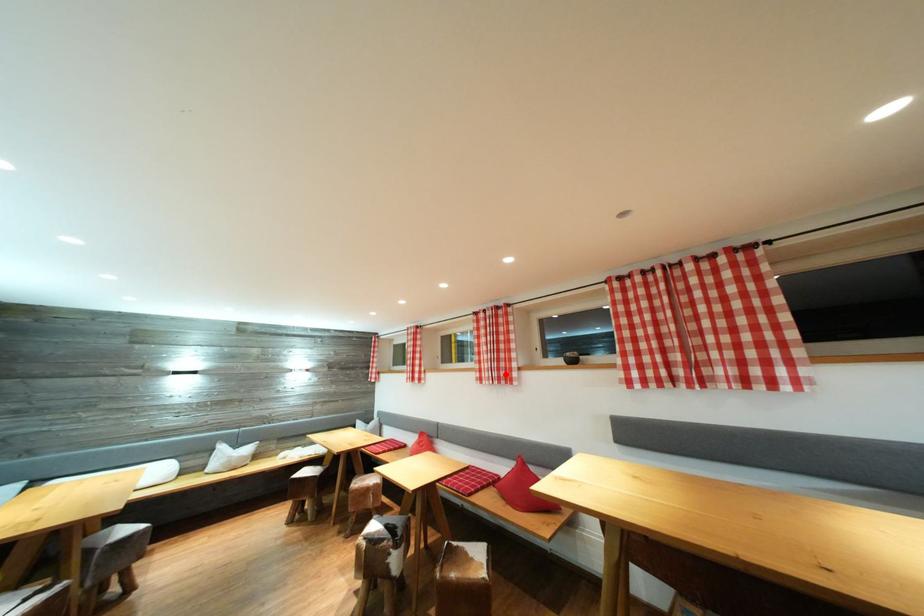
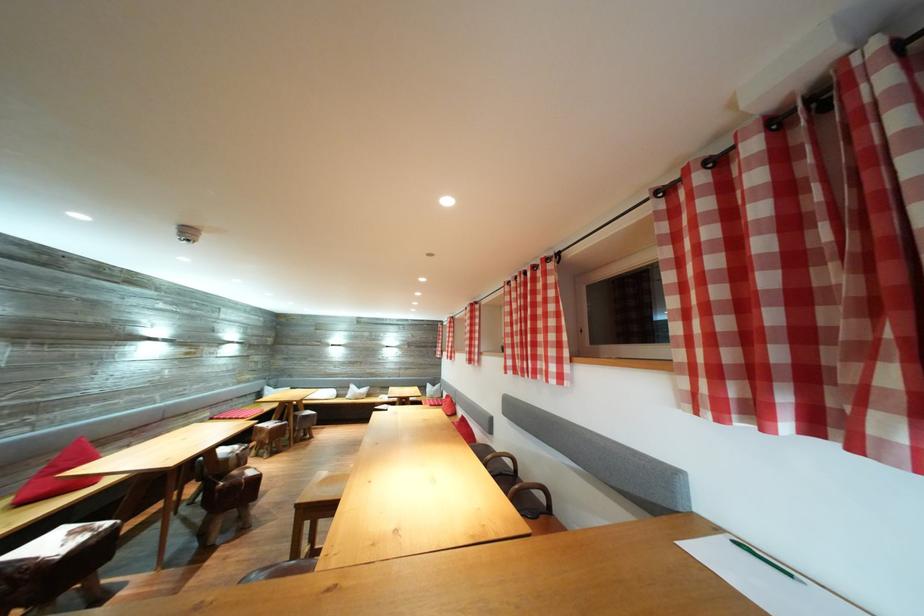
Where in the second image is the point corresponding to the highlighted location from the first image?

(477, 359)